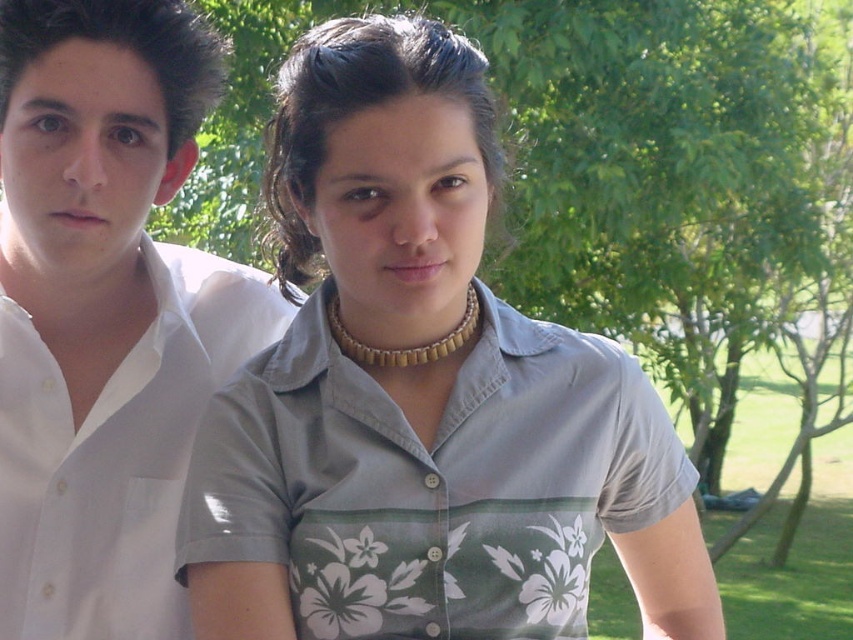
Can you confirm if gray fabric shirt at center is smaller than white cotton shirt at left?

No, gray fabric shirt at center is not smaller than white cotton shirt at left.

What are the coordinates of `gray fabric shirt at center` in the screenshot? It's located at (422, 394).